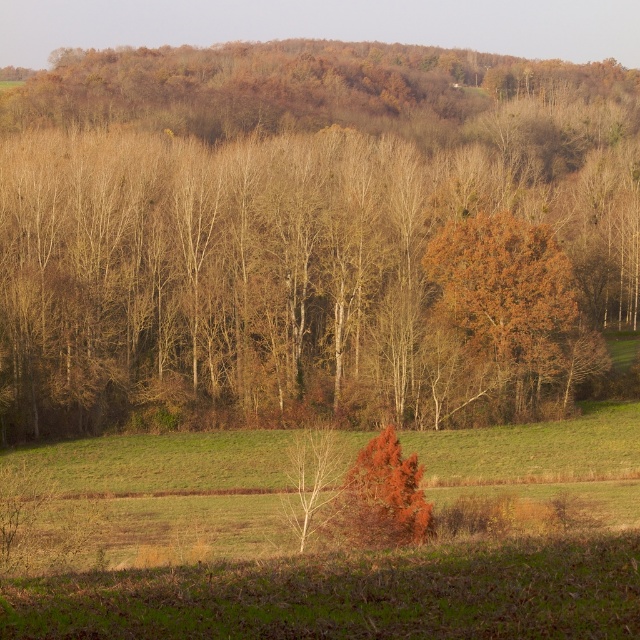
Question: Can you confirm if brown leafless tree at center is thinner than orange-brown wood at center-right?

Choices:
 (A) no
 (B) yes

Answer: (A)

Question: Which point appears farthest from the camera in this image?

Choices:
 (A) (378, 486)
 (B) (556, 352)

Answer: (B)

Question: Which of the following is the farthest from the observer?

Choices:
 (A) (356, 477)
 (B) (512, 342)

Answer: (B)

Question: Is brown leafless tree at center positioned before orange-brown wood at center-right?

Choices:
 (A) yes
 (B) no

Answer: (A)

Question: In this image, where is brown leafless tree at center located relative to orange-brown wood at center-right?

Choices:
 (A) left
 (B) right

Answer: (A)

Question: Considering the real-world distances, which object is farthest from the orange-brown bark tree at lower center?

Choices:
 (A) brown leafless tree at center
 (B) orange-brown wood at center-right

Answer: (A)